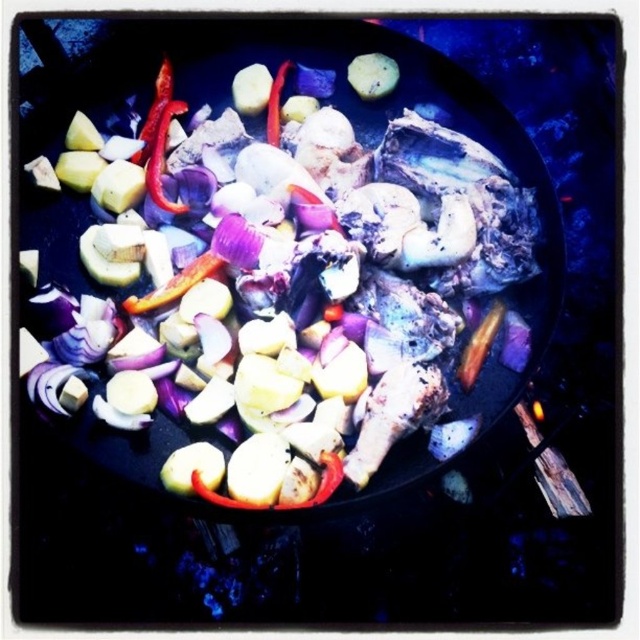
You are a chef standing in front of the cooking area. You need to place a new ingredient on the black matte wok at center. Where exactly should you place it?

The black matte wok at center is located at point (278,259) so you should place the new ingredient there.

You are holding a 2.0 meter long pole. You want to use it to reach the point at coordinates point (291, 188) in the image. Will the pole be long enough to reach that point?

The distance between point (291, 188) and the camera is 1.97 meters. Since the pole is 2.0 meters long, it will be just long enough to reach the point at point (291, 188).